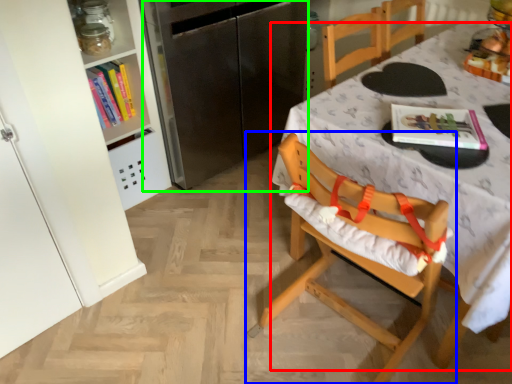
Question: Estimate the real-world distances between objects in this image. Which object is closer to table (highlighted by a red box), chair (highlighted by a blue box) or appliance (highlighted by a green box)?

Choices:
 (A) chair
 (B) appliance

Answer: (A)